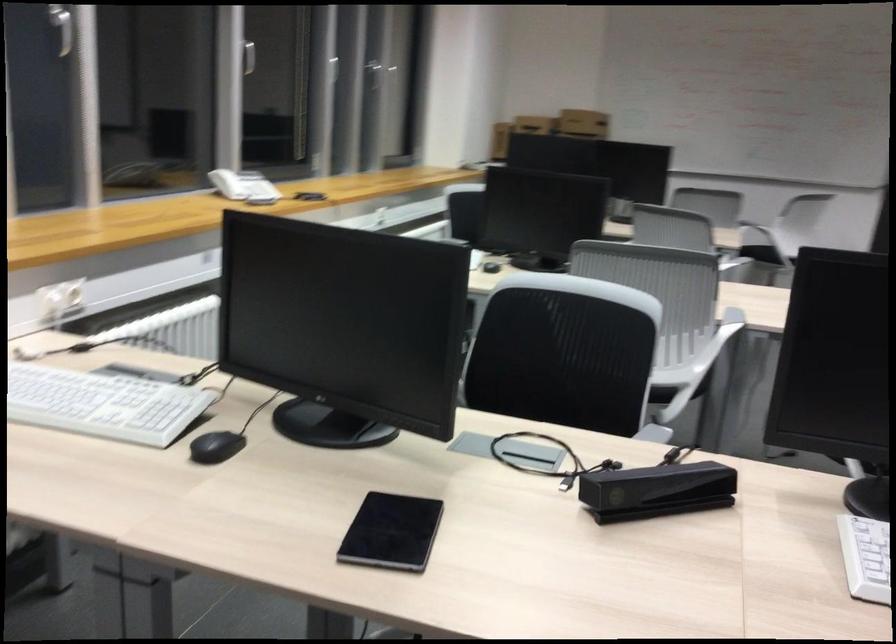
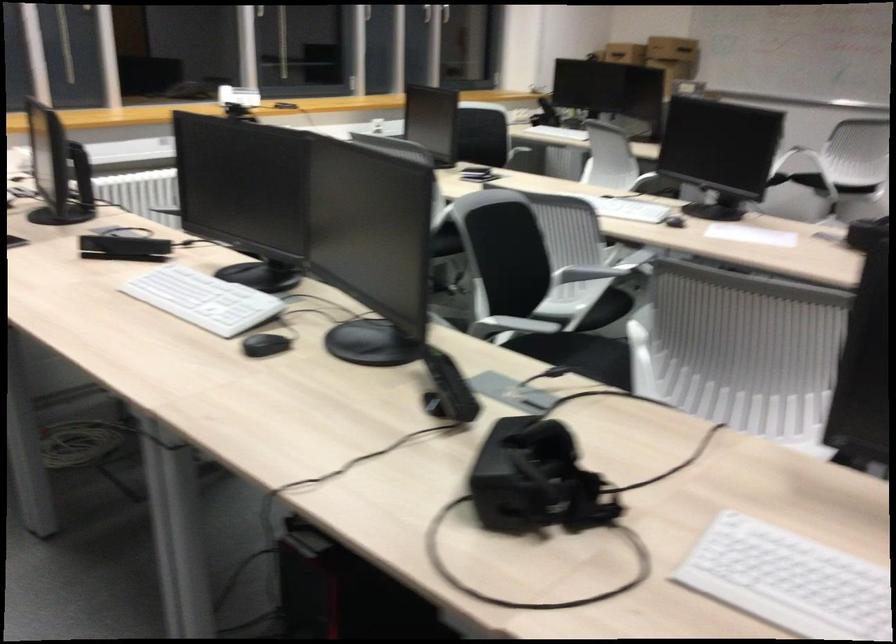
Locate, in the second image, the point that corresponds to point 694,374 in the first image.

(445, 242)